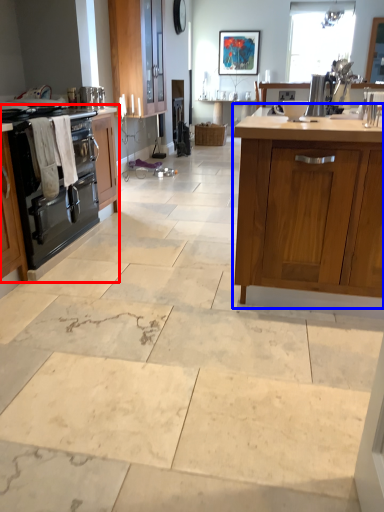
Question: Which object is further to the camera taking this photo, cabinetry (highlighted by a red box) or cabinetry (highlighted by a blue box)?

Choices:
 (A) cabinetry
 (B) cabinetry

Answer: (A)